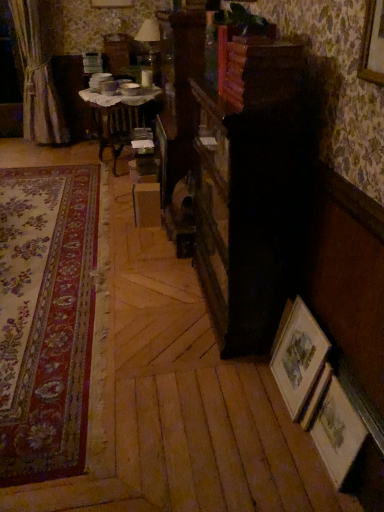
Question: Considering the relative sizes of floral carpet at left and matte white lampshade at upper center in the image provided, is floral carpet at left bigger than matte white lampshade at upper center?

Choices:
 (A) no
 (B) yes

Answer: (B)

Question: From a real-world perspective, is floral carpet at left positioned over matte white lampshade at upper center based on gravity?

Choices:
 (A) yes
 (B) no

Answer: (B)

Question: Does floral carpet at left appear on the right side of matte white lampshade at upper center?

Choices:
 (A) no
 (B) yes

Answer: (A)

Question: Is matte white lampshade at upper center at the back of floral carpet at left?

Choices:
 (A) no
 (B) yes

Answer: (A)

Question: From the image's perspective, is floral carpet at left below matte white lampshade at upper center?

Choices:
 (A) yes
 (B) no

Answer: (A)

Question: Does floral carpet at left contain matte white lampshade at upper center?

Choices:
 (A) yes
 (B) no

Answer: (B)

Question: Is wooden at upper center to the left of wooden framed print at lower right, which appears as the 1th picture frame when viewed from the left, from the viewer's perspective?

Choices:
 (A) yes
 (B) no

Answer: (A)

Question: Could you tell me if wooden at upper center is turned towards wooden framed print at lower right, which appears as the 2th picture frame when viewed from the right?

Choices:
 (A) yes
 (B) no

Answer: (B)

Question: Considering the relative positions of wooden at upper center and wooden framed print at lower right, which appears as the 1th picture frame when viewed from the left, in the image provided, is wooden at upper center to the right of wooden framed print at lower right, which appears as the 1th picture frame when viewed from the left, from the viewer's perspective?

Choices:
 (A) yes
 (B) no

Answer: (B)

Question: Is wooden at upper center thinner than wooden framed print at lower right, which appears as the 2th picture frame when viewed from the right?

Choices:
 (A) yes
 (B) no

Answer: (B)

Question: From the image's perspective, is wooden at upper center on wooden framed print at lower right, which appears as the 2th picture frame when viewed from the right?

Choices:
 (A) no
 (B) yes

Answer: (B)

Question: Is wooden framed print at lower right, which appears as the 1th picture frame when viewed from the left, at the back of wooden at upper center?

Choices:
 (A) no
 (B) yes

Answer: (A)

Question: Is wooden framed print at lower right, which appears as the 2th picture frame when viewed from the right, smaller than floral carpet at left?

Choices:
 (A) yes
 (B) no

Answer: (A)